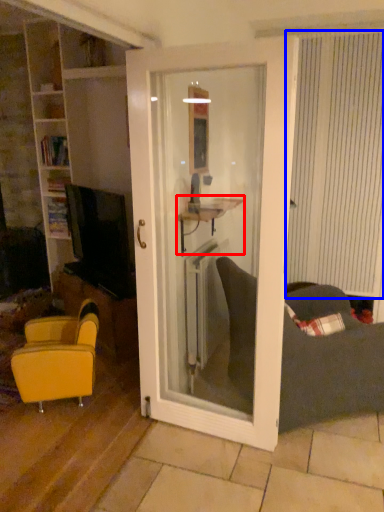
Question: Which object is closer to the camera taking this photo, table (highlighted by a red box) or curtain (highlighted by a blue box)?

Choices:
 (A) table
 (B) curtain

Answer: (A)